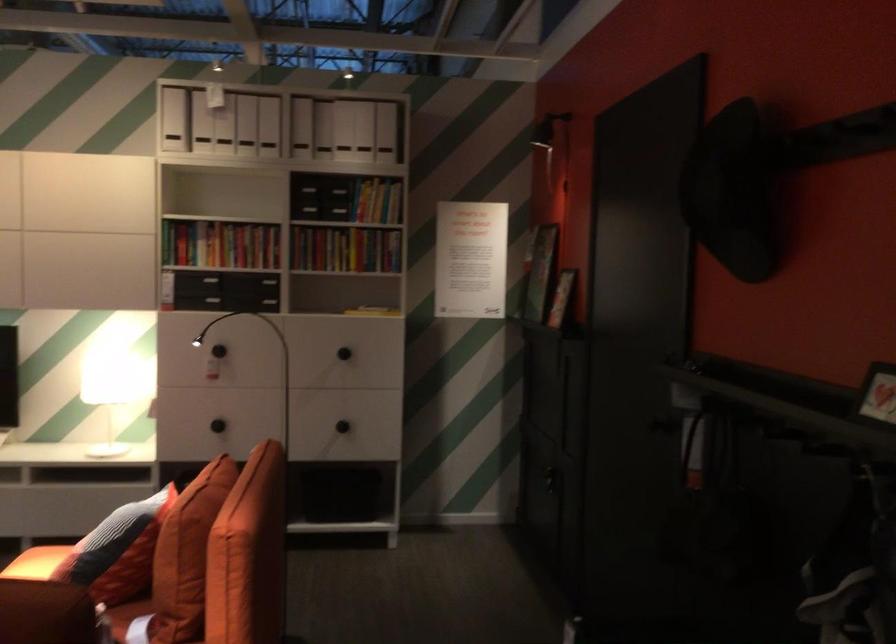
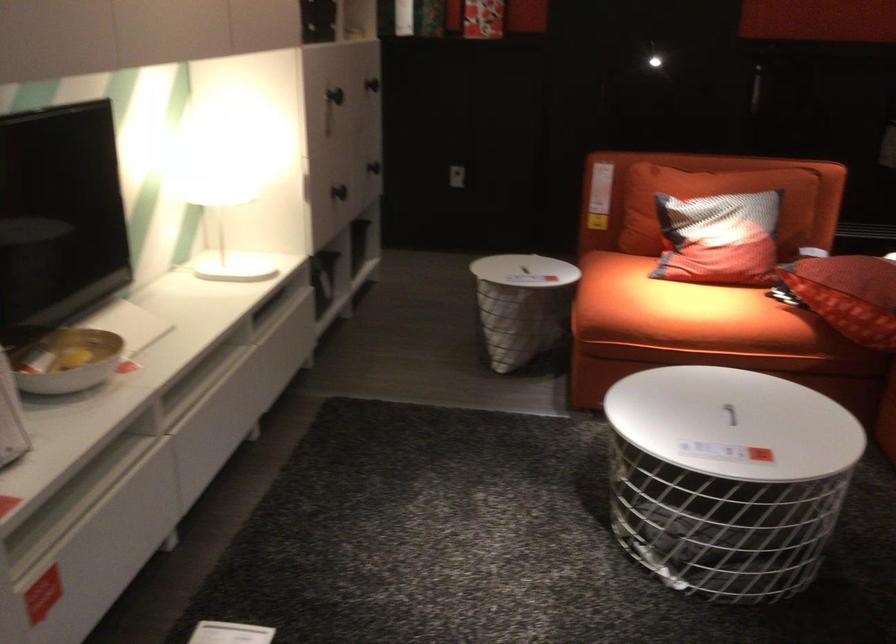
In the second image, find the point that corresponds to point 336,355 in the first image.

(372, 84)